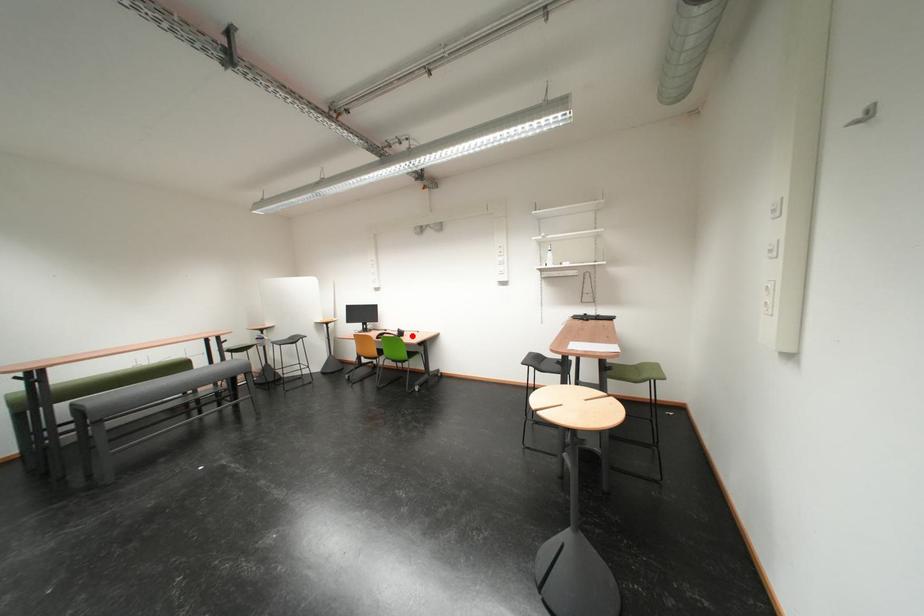
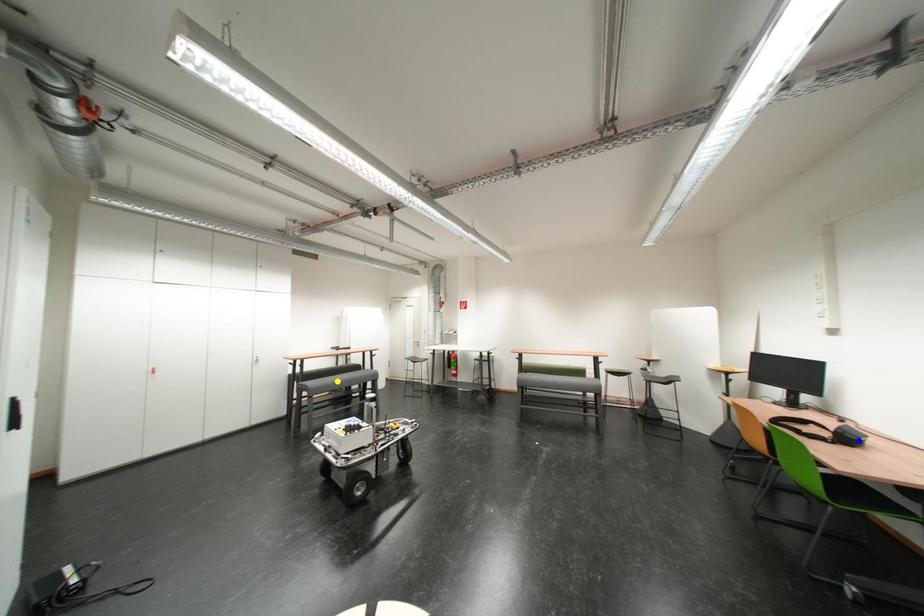
Question: I am providing you with two images of the same scene from different viewpoints. A red point is marked on the first image. You are given multiple points on the second image. In image 2, which mark is for the same physical point as the one in image 1?

Choices:
 (A) blue point
 (B) yellow point
 (C) green point

Answer: (A)